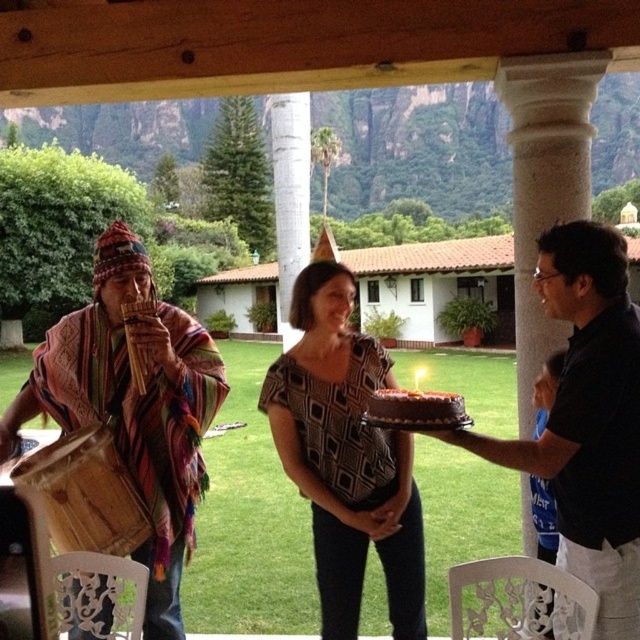
Between black matte shirt at center and chocolate frosted cake at center, which one has less height?

chocolate frosted cake at center

Can you confirm if black matte shirt at center is thinner than chocolate frosted cake at center?

Incorrect, black matte shirt at center's width is not less than chocolate frosted cake at center's.

Is point (586, 298) in front of point (422, 420)?

No, (586, 298) is behind (422, 420).

You are a GUI agent. You are given a task and a screenshot of the screen. Output one action in this format:
    pyautogui.click(x=<x>, y=<y>)
    Task: Click on the black matte shirt at center
    This screenshot has height=640, width=640.
    Given the screenshot: What is the action you would take?
    pyautogui.click(x=588, y=419)

Does point (186, 380) come in front of point (390, 388)?

Yes, point (186, 380) is in front of point (390, 388).

Describe the element at coordinates (170, 449) in the screenshot. The height and width of the screenshot is (640, 640). I see `wooden flute at left` at that location.

Where is `wooden flute at left`? This screenshot has height=640, width=640. wooden flute at left is located at coordinates (170, 449).

Looking at this image, is wooden flute at left to the left of black matte shirt at center from the viewer's perspective?

Correct, you'll find wooden flute at left to the left of black matte shirt at center.

Where is `wooden flute at left`? This screenshot has height=640, width=640. wooden flute at left is located at coordinates (170, 449).

Which is in front, point (163, 572) or point (582, 292)?

Positioned in front is point (582, 292).

Where is `wooden flute at left`? Image resolution: width=640 pixels, height=640 pixels. wooden flute at left is located at coordinates (170, 449).